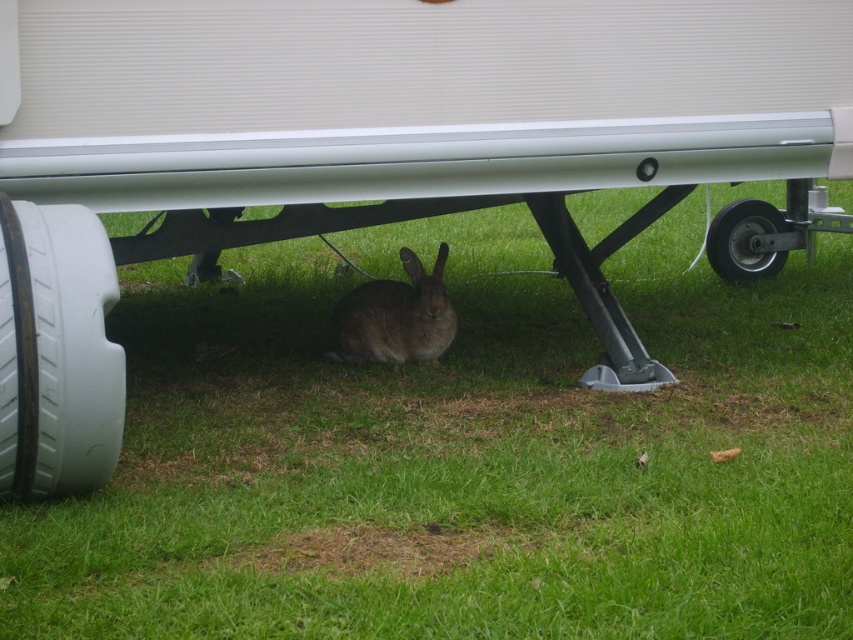
Question: Which object appears closest to the camera in this image?

Choices:
 (A) black rubber tire at lower right
 (B) brown fur rabbit at center

Answer: (B)

Question: Is brown fur rabbit at center below black rubber tire at lower right?

Choices:
 (A) yes
 (B) no

Answer: (A)

Question: Which point is closer to the camera?

Choices:
 (A) (405, 316)
 (B) (723, 230)

Answer: (A)

Question: Can you confirm if brown fur rabbit at center is positioned below black rubber tire at lower right?

Choices:
 (A) yes
 (B) no

Answer: (A)

Question: Can you confirm if brown fur rabbit at center is thinner than black rubber tire at lower right?

Choices:
 (A) no
 (B) yes

Answer: (A)

Question: Which of the following is the closest to the observer?

Choices:
 (A) click(x=334, y=317)
 (B) click(x=767, y=211)

Answer: (A)